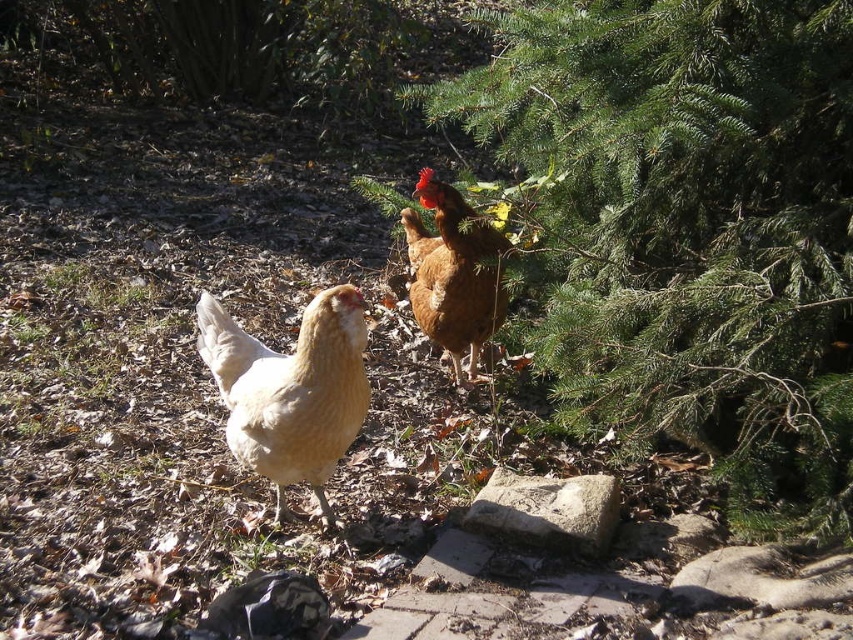
You are a photographer trying to capture both chickens in a single shot. Since the light brown feathered chicken at center is blocking the view of the brown matte chicken at upper center, can you adjust your position to include both without moving the chickens?

The light brown feathered chicken at center is closer to the viewer than the brown matte chicken at upper center. By moving your position slightly backward or to the side, you can adjust your angle to include both chickens in the frame without moving them.

You are a farmer checking the health of your chickens. You notice two chickens in the garden. The light brown feathered chicken at center and the brown matte chicken at upper center. Which chicken has a larger body size?

The light brown feathered chicken at center has a larger body size because its width surpasses that of the brown matte chicken at upper center.